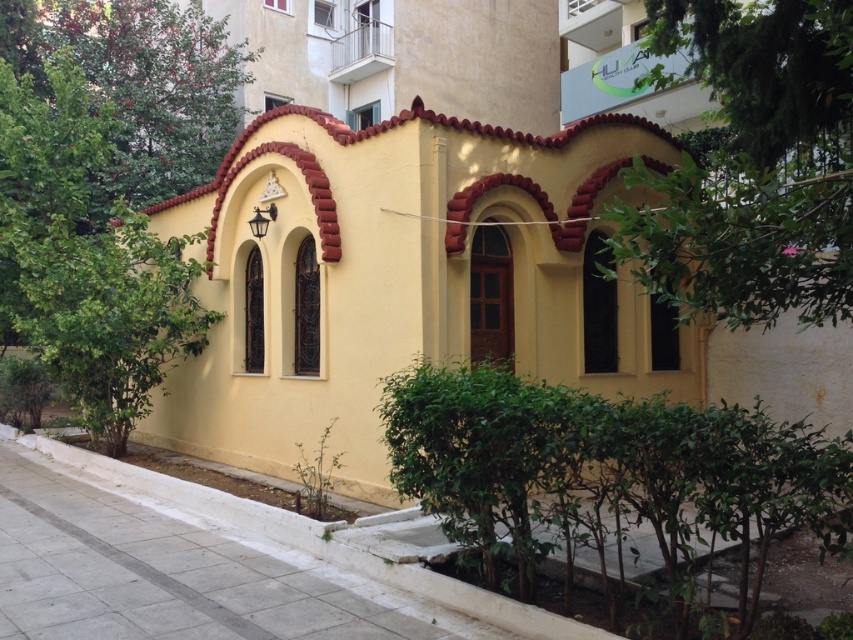
Does point (381, 276) come farther from viewer compared to point (209, 538)?

Yes, it is behind point (209, 538).

Who is more forward, [642,339] or [291,563]?

Point [291,563] is more forward.

Locate an element on the screen. yellow matte building at center is located at coordinates (438, 285).

Based on the photo, is green leafy tree at upper right bigger than green leafy tree at upper left?

No.

Is green leafy tree at upper right taller than green leafy tree at upper left?

In fact, green leafy tree at upper right may be shorter than green leafy tree at upper left.

Does point (624, 205) come farther from viewer compared to point (18, 44)?

That is False.

This screenshot has width=853, height=640. Identify the location of green leafy tree at upper right. (753, 166).

Is yellow matte building at center above green leafy tree at upper left?

No, yellow matte building at center is not above green leafy tree at upper left.

Does point (670, 371) come farther from viewer compared to point (100, 58)?

That is False.

Is point (329, 268) positioned behind point (144, 173)?

No.

You are a GUI agent. You are given a task and a screenshot of the screen. Output one action in this format:
    pyautogui.click(x=<x>, y=<y>)
    Task: Click on the yellow matte building at center
    The image size is (853, 640).
    Given the screenshot: What is the action you would take?
    pyautogui.click(x=438, y=285)